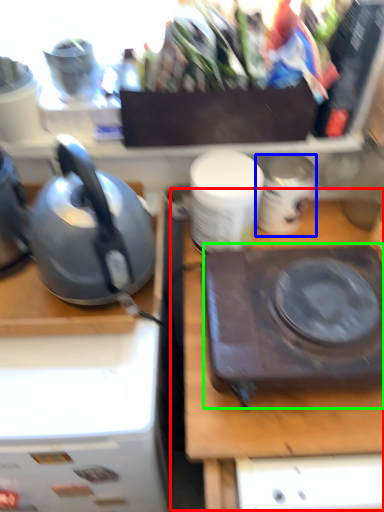
Question: Considering the real-world distances, which object is closest to table (highlighted by a red box)? appliance (highlighted by a blue box) or kitchen appliance (highlighted by a green box).

Choices:
 (A) appliance
 (B) kitchen appliance

Answer: (B)